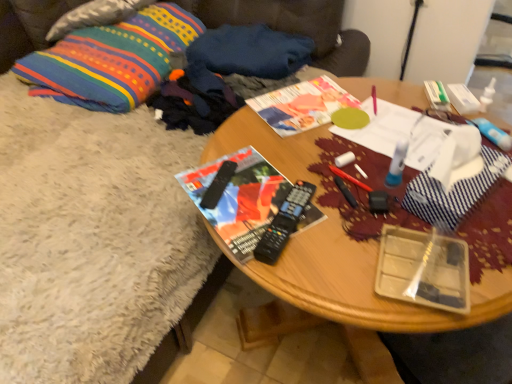
Find the location of a particular element. Image resolution: width=512 pixels, height=384 pixels. vacant location below matte black magazine at center (from a real-world perspective) is located at coordinates (250, 202).